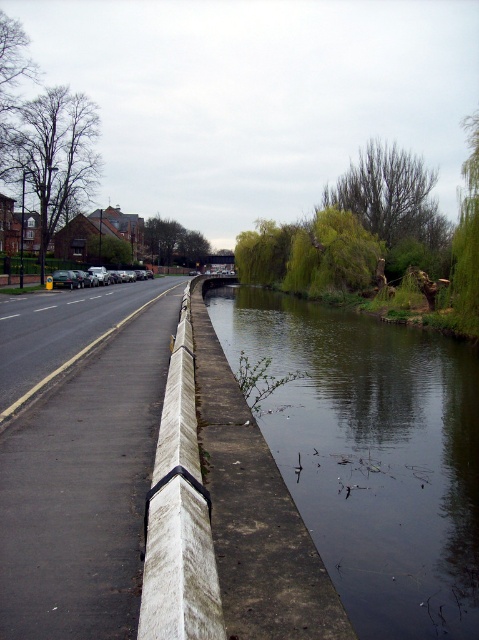
Describe the element at coordinates (372, 454) in the screenshot. The image size is (479, 640). I see `dark reflective water at center` at that location.

Who is lower down, dark reflective water at center or white concrete curb at center?

dark reflective water at center

The height and width of the screenshot is (640, 479). In order to click on dark reflective water at center in this screenshot , I will do `click(372, 454)`.

Locate an element on the screen. dark reflective water at center is located at coordinates (372, 454).